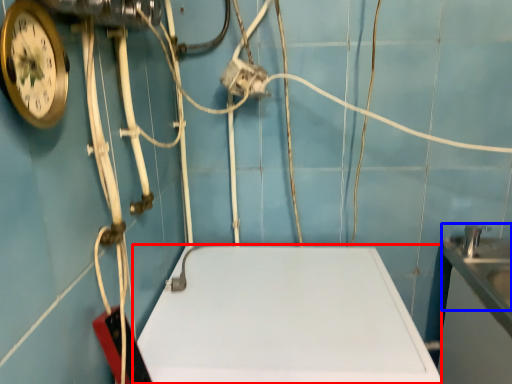
Question: Which object is closer to the camera taking this photo, counter top (highlighted by a red box) or sink (highlighted by a blue box)?

Choices:
 (A) counter top
 (B) sink

Answer: (A)